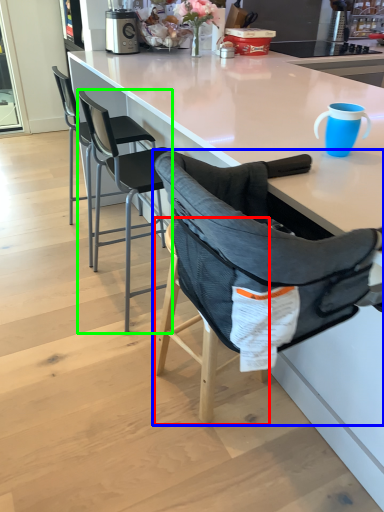
Question: Estimate the real-world distances between objects in this image. Which object is closer to bar stool (highlighted by a red box), chair (highlighted by a blue box) or chair (highlighted by a green box)?

Choices:
 (A) chair
 (B) chair

Answer: (A)